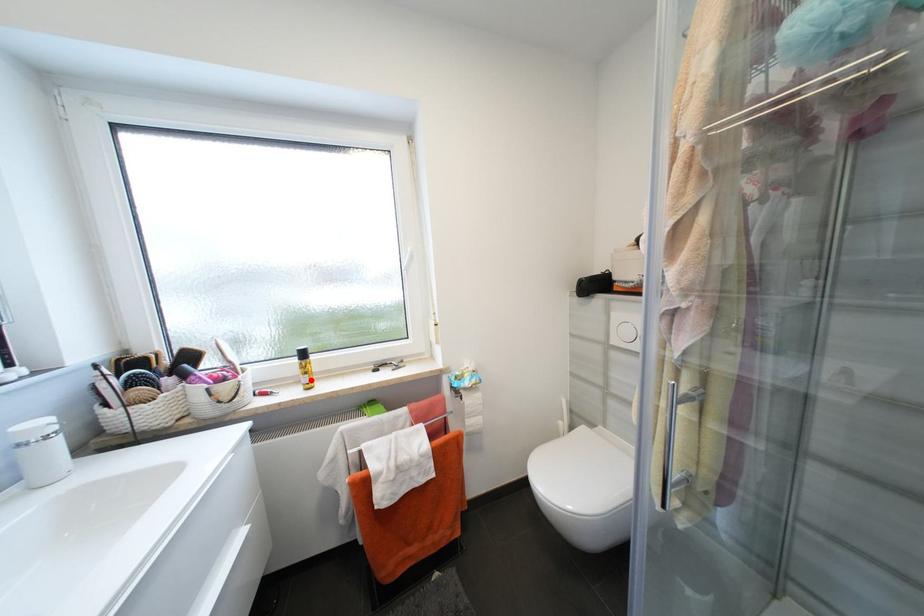
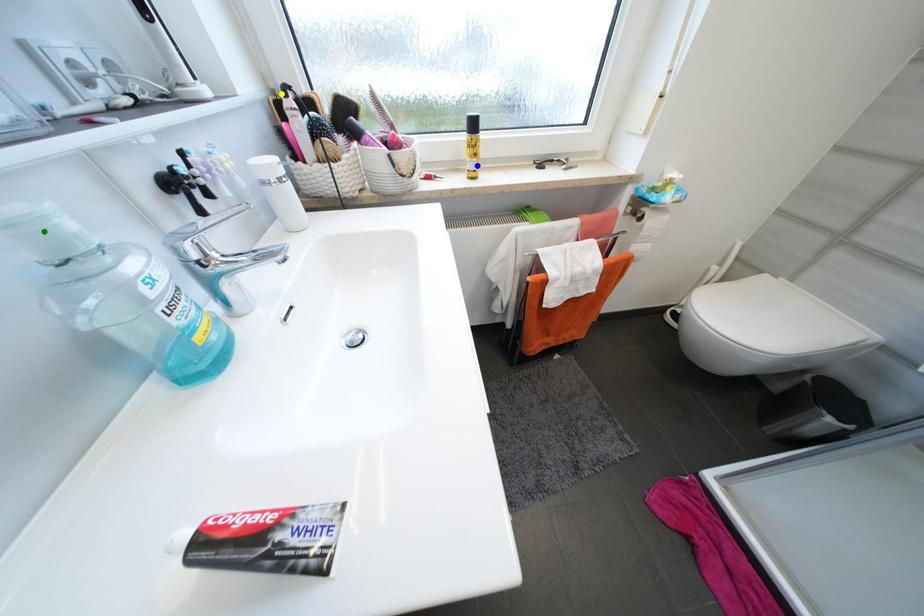
Question: I am providing you with two images of the same scene from different viewpoints. A red point is marked on the first image. You are given multiple points on the second image. In image 2, which mark is for the same physical point as the one in image 1?

Choices:
 (A) yellow point
 (B) green point
 (C) blue point

Answer: (C)